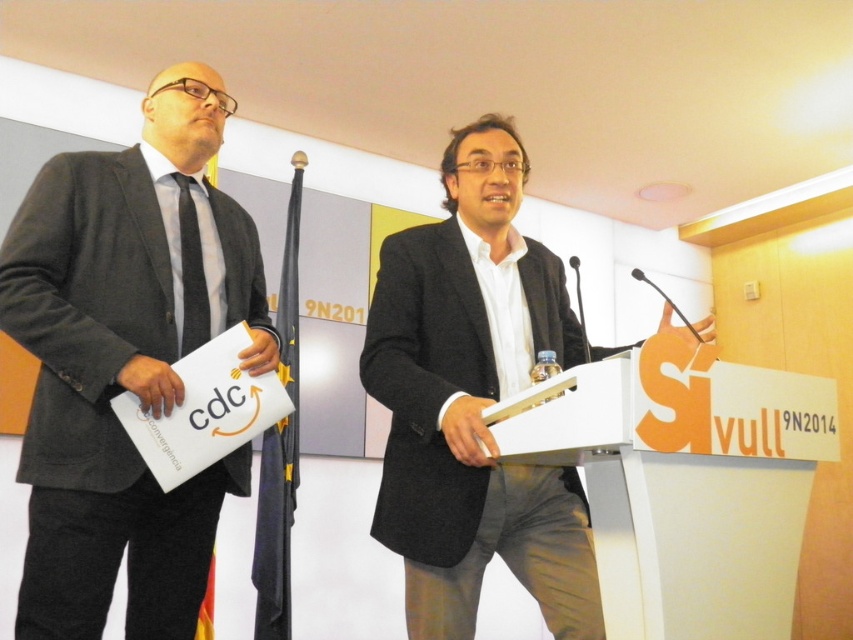
You are organizing a charity event and need to display two items on a shelf. The shelf has limited space. The items are the dark gray wool coat at center and the black striped tie at left. Which item will require more space on the shelf?

The dark gray wool coat at center requires more space on the shelf because it has a larger size compared to the black striped tie at left.

You are attending a formal event and need to retrieve your dark gray wool coat at center. If your arms are 2 feet long, can you reach it without moving closer?

The dark gray wool coat at center is 4.71 feet away from the viewer. Since your arms are only 2 feet long, you cannot reach it without moving closer.